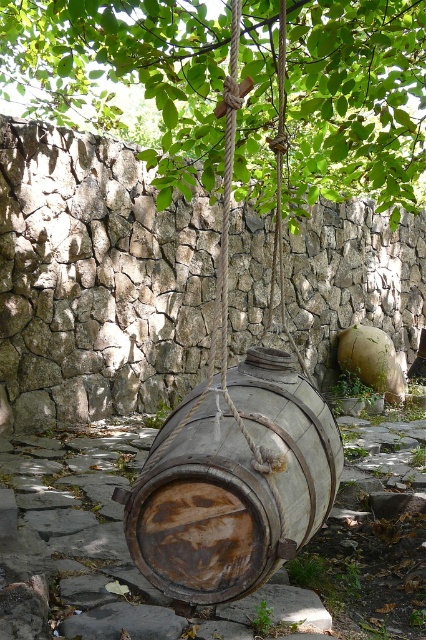
You are standing at the stone wall and want to walk to the wooden barrel. Which point do you pass first, point (x=317, y=99) or point (x=296, y=513)?

You will pass point (x=296, y=513) first because it is in front of point (x=317, y=99) when moving from the stone wall to the wooden barrel.

You are standing on the stone pathway and want to place a small potted plant between the green leafy tree at upper center and the rusty wood barrel at center. Since the tree is above the barrel, where should you place the potted plant to ensure it is between them?

The green leafy tree at upper center is positioned over the rusty wood barrel at center, so you should place the potted plant on the ground near the rusty wood barrel at center, directly below the tree to be between them.

Looking at this image, you are standing at the point labeled point (123, 74) in the image. Looking around, you see a large wooden barrel and a stone wall. Which object is closer to your current position?

The green leafy tree at upper center is closer to your current position because the point (123, 74) corresponds to it, placing you near the tree rather than the barrel or wall.